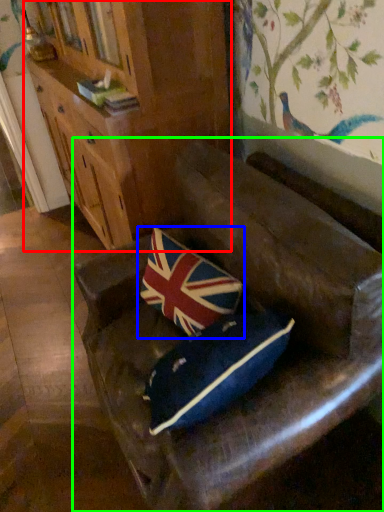
Question: Which object is positioned farthest from cabinetry (highlighted by a red box)? Select from pillow (highlighted by a blue box) and furniture (highlighted by a green box).

Choices:
 (A) pillow
 (B) furniture

Answer: (B)